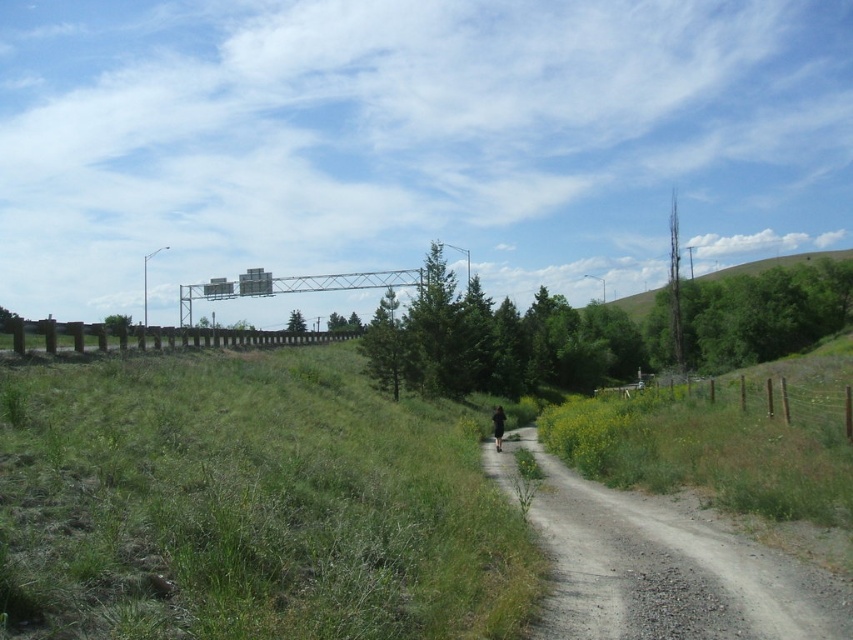
Who is shorter, green wooden fence at right or green grassy hillside at upper right?

green wooden fence at right is shorter.

Between point (740, 380) and point (619, 300), which one is positioned behind?

The point (619, 300) is more distant.

Image resolution: width=853 pixels, height=640 pixels. I want to click on green wooden fence at right, so click(x=753, y=397).

Can you confirm if green wooden fence at right is shorter than black fabric person at center-right?

No, green wooden fence at right is not shorter than black fabric person at center-right.

Who is more forward, (664,394) or (495,408)?

Point (664,394) is in front.

The image size is (853, 640). In order to click on green wooden fence at right in this screenshot , I will do `click(753, 397)`.

In order to click on green wooden fence at right in this screenshot , I will do `click(753, 397)`.

Can you confirm if gray gravel path at center is positioned to the left of green wooden fence at right?

Correct, you'll find gray gravel path at center to the left of green wooden fence at right.

Is the position of gray gravel path at center more distant than that of green wooden fence at right?

That is False.

Which is in front, point (747, 596) or point (788, 401)?

Point (747, 596) is in front.

The width and height of the screenshot is (853, 640). Find the location of `gray gravel path at center`. gray gravel path at center is located at coordinates (662, 566).